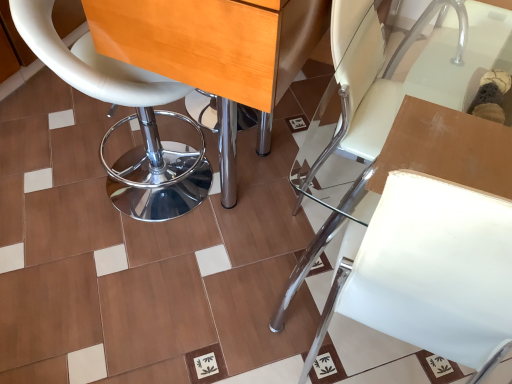
Locate an element on the screen. The height and width of the screenshot is (384, 512). space that is in front of white leather stool at left, which is the 2th chair from right to left is located at coordinates (124, 290).